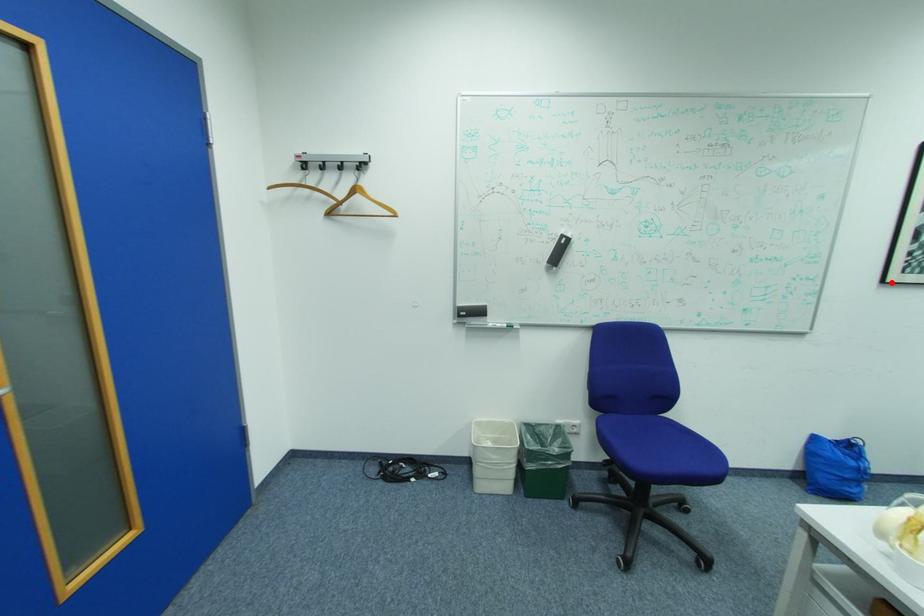
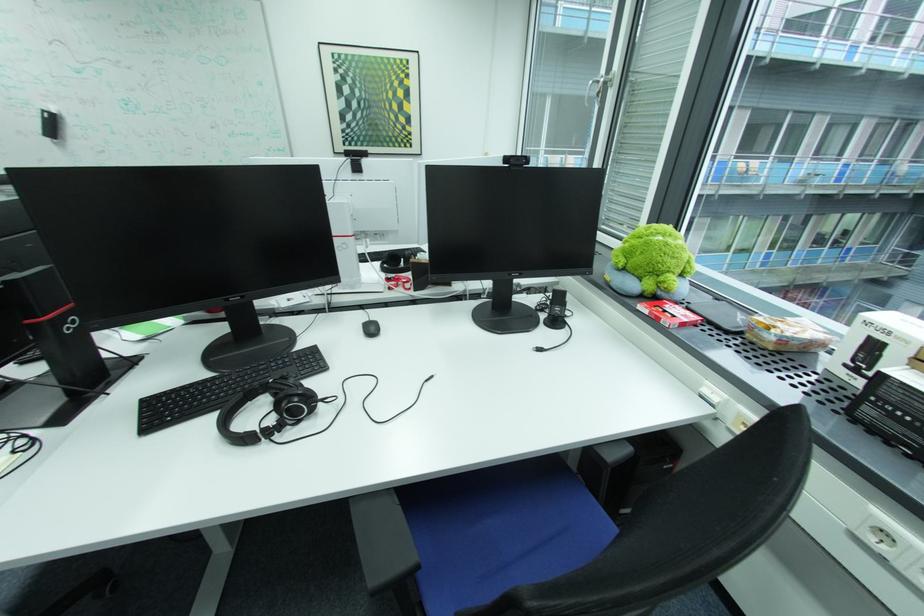
Locate, in the second image, the point that corresponds to the highlighted location in the first image.

(344, 153)